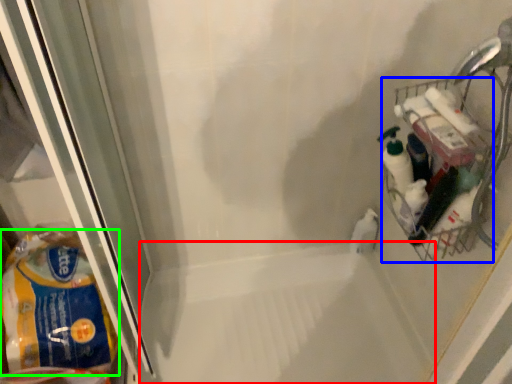
Question: Which object is positioned farthest from bath (highlighted by a red box)? Select from basket (highlighted by a blue box) and material (highlighted by a green box).

Choices:
 (A) basket
 (B) material

Answer: (A)